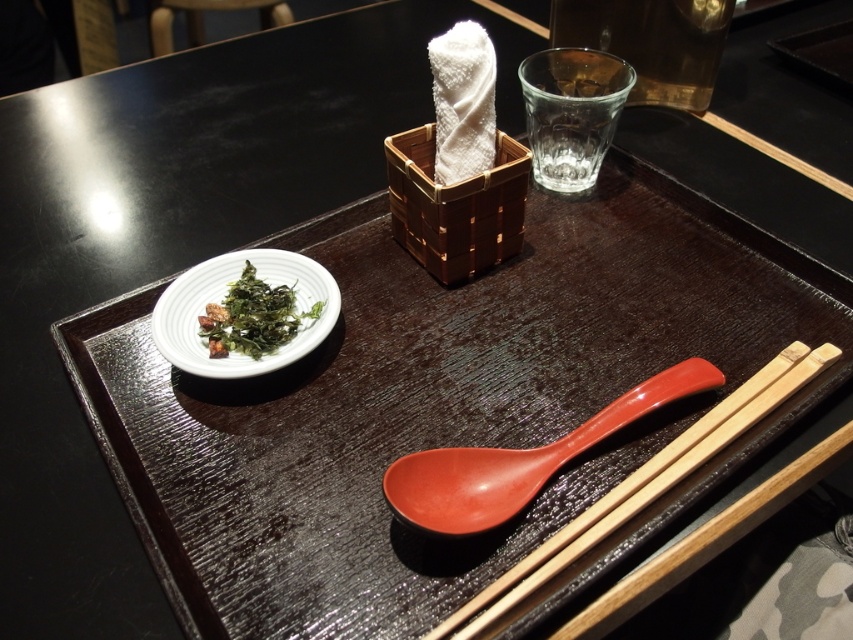
Who is lower down, matte orange spoon at lower center or green leafymaterial/texture at left?

matte orange spoon at lower center is lower down.

Based on the photo, between matte orange spoon at lower center and green leafymaterial/texture at left, which one appears on the left side from the viewer's perspective?

Positioned to the left is green leafymaterial/texture at left.

Which is in front, point (451, 529) or point (230, 323)?

Positioned in front is point (451, 529).

What are the coordinates of `matte orange spoon at lower center` in the screenshot? It's located at (518, 461).

Can you confirm if matte orange spoon at lower center is shorter than wooden chopsticks at lower right?

Correct, matte orange spoon at lower center is not as tall as wooden chopsticks at lower right.

Between matte orange spoon at lower center and wooden chopsticks at lower right, which one is positioned lower?

wooden chopsticks at lower right is lower down.

Which is behind, point (637, 392) or point (630, 490)?

The point (637, 392) is behind.

This screenshot has width=853, height=640. Identify the location of matte orange spoon at lower center. (518, 461).

Which of these two, wooden chopsticks at lower right or green leafymaterial/texture at left, stands taller?

wooden chopsticks at lower right is taller.

Does wooden chopsticks at lower right appear under green leafymaterial/texture at left?

Indeed, wooden chopsticks at lower right is positioned under green leafymaterial/texture at left.

Is point (724, 420) behind point (267, 289)?

That is False.

Locate an element on the screen. wooden chopsticks at lower right is located at coordinates (642, 486).